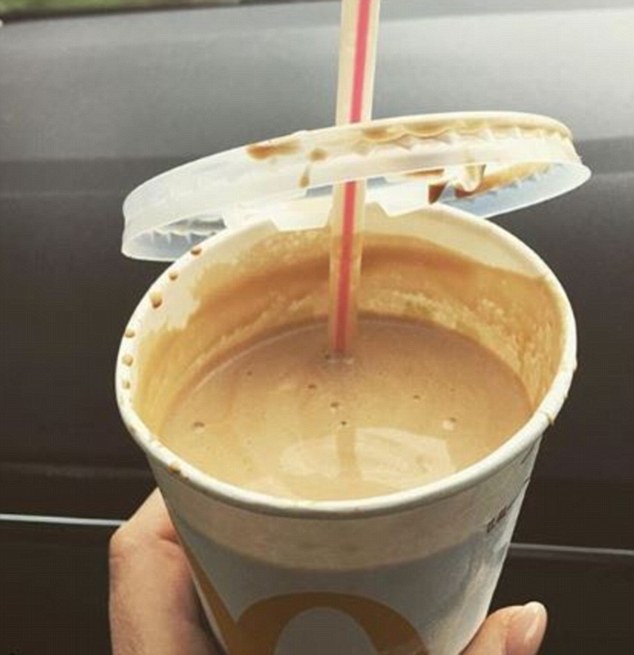
This screenshot has height=655, width=634. Identify the location of bottom rim of cup. (332, 508).